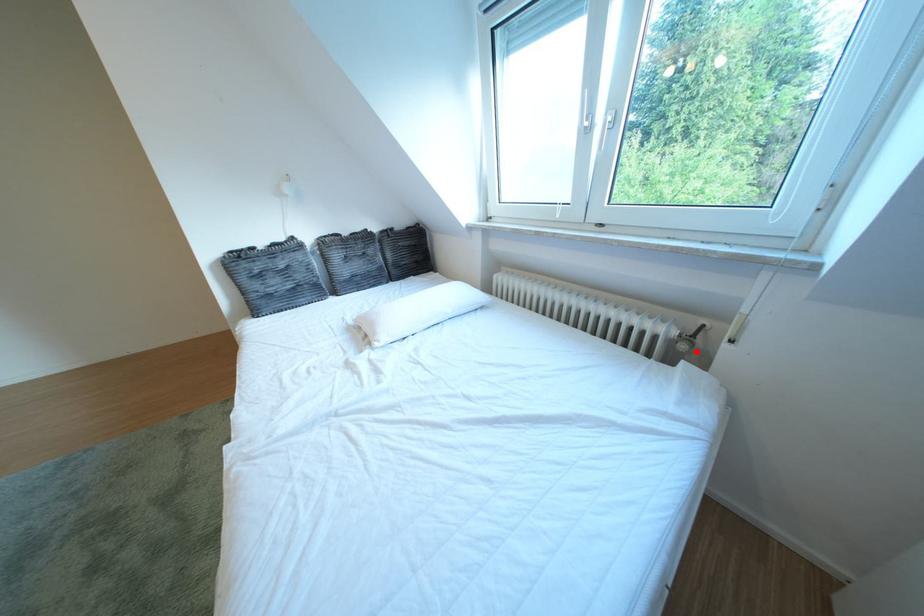
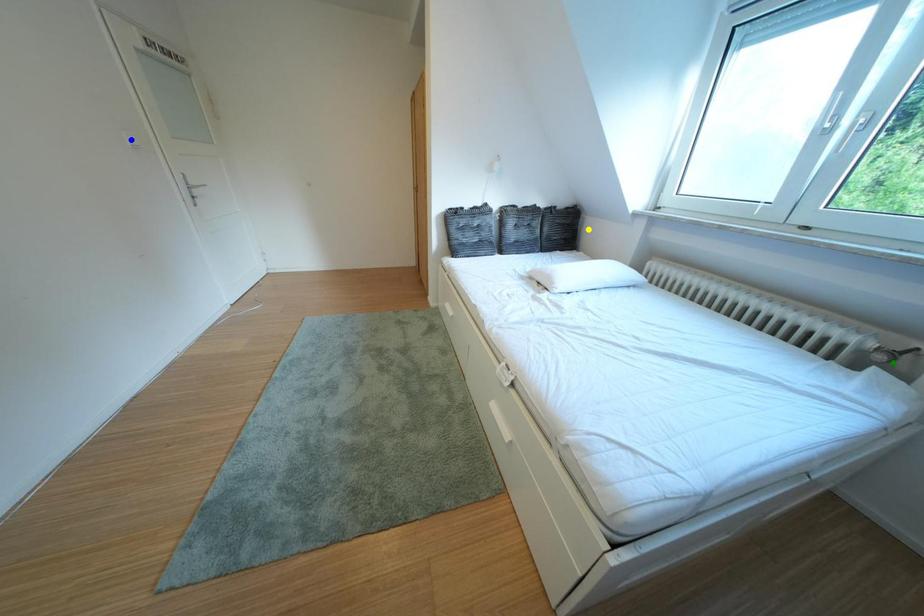
Question: I am providing you with two images of the same scene from different viewpoints. A red point is marked on the first image. You are given multiple points on the second image. Which point in image 2 is actually the same real-world point as the red point in image 1?

Choices:
 (A) green point
 (B) yellow point
 (C) blue point

Answer: (A)